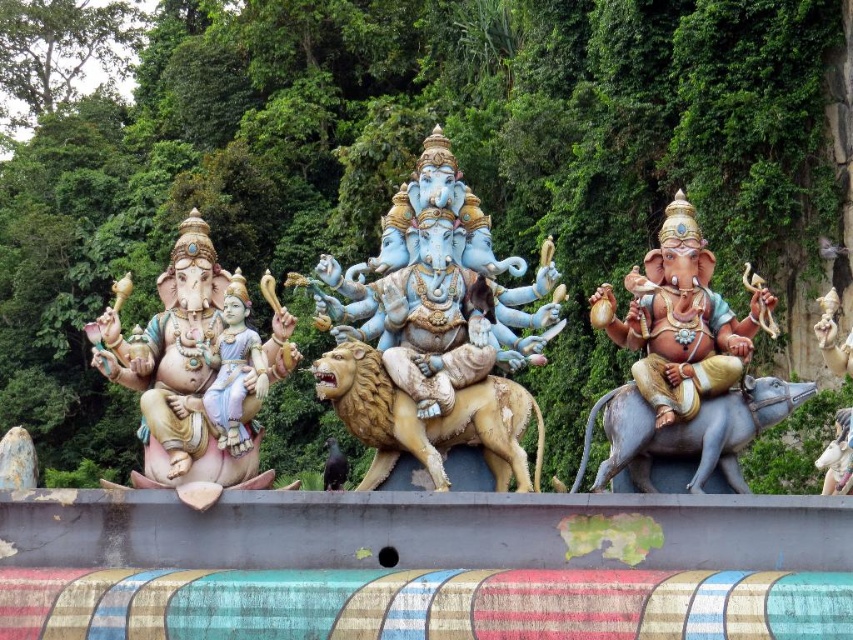
You are an art curator planning to move the blue glossy statue at center and the blue stone elephant at right to a new exhibition space. If you want to maintain their original relative positions as seen in the image, which statue should be placed to the left of the other?

The blue glossy statue at center should be placed to the left of the blue stone elephant at right to maintain their original relative positions as seen in the image.

You are standing in front of the statues and want to take a photo of the matte pink statue at left and the blue stone elephant at right. Which statue will appear larger in the photo?

The matte pink statue at left will appear larger in the photo because it is closer to you than the blue stone elephant at right.

You are a tourist standing in front of the statues and want to take a photo of the point at coordinates (190, 374). Which statue should you focus on?

The point at coordinates (190, 374) is on the matte pink statue at left, so you should focus on the matte pink statue at left to capture that point in your photo.